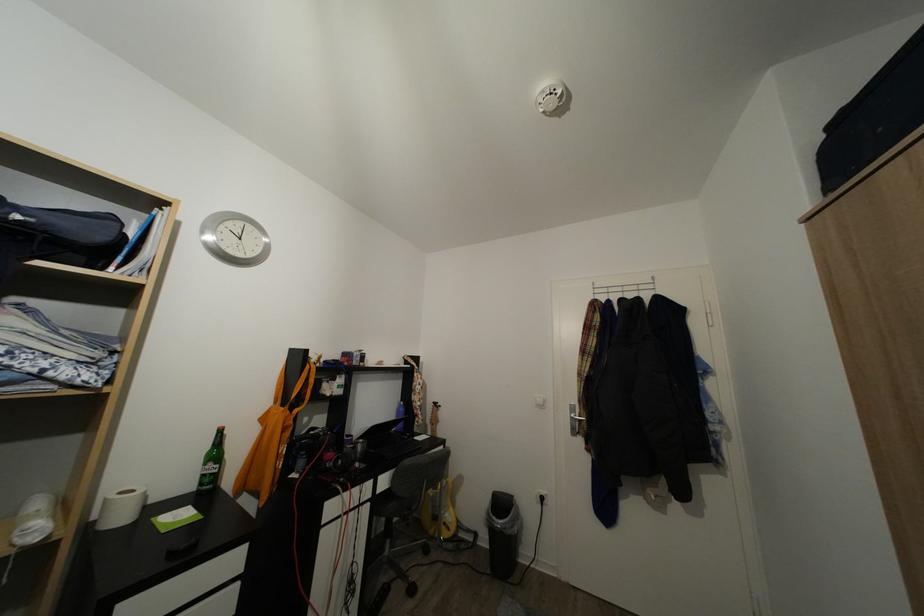
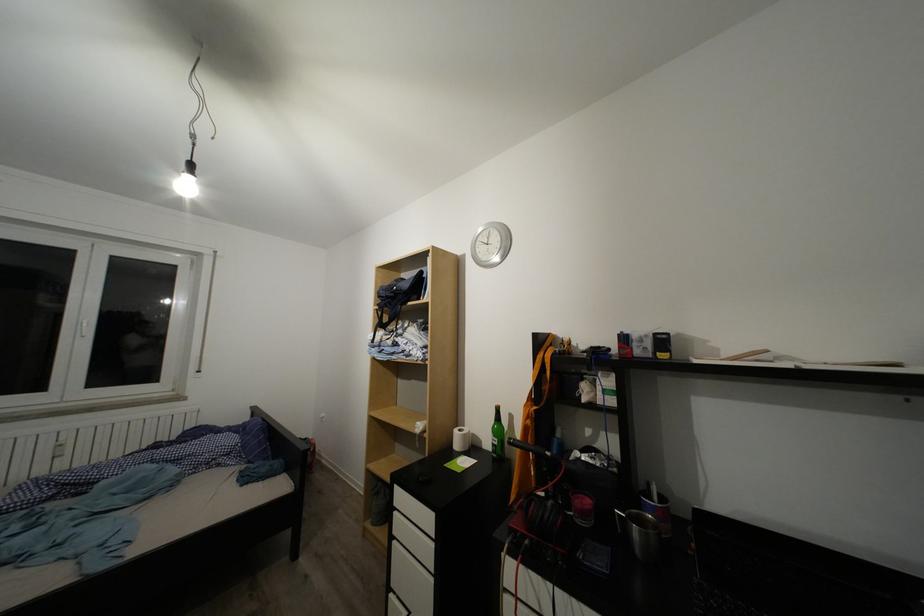
The point at (129,500) is marked in the first image. Where is the corresponding point in the second image?

(468, 436)